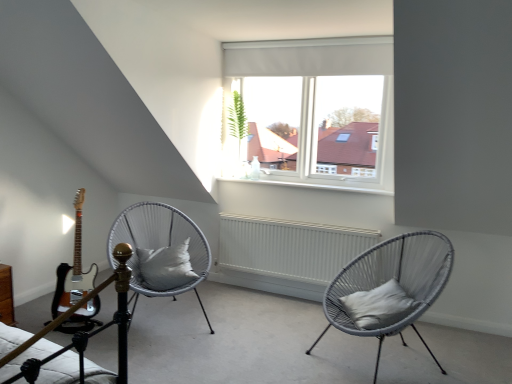
Locate an element on the screen. The image size is (512, 384). blank area beneath woven grey chair at center, the second chair viewed from the left (from a real-world perspective) is located at coordinates (378, 363).